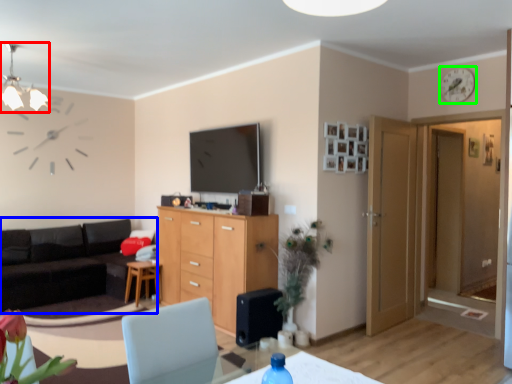
Question: Estimate the real-world distances between objects in this image. Which object is farther from light fixture (highlighted by a red box), studio couch (highlighted by a blue box) or clock (highlighted by a green box)?

Choices:
 (A) studio couch
 (B) clock

Answer: (B)